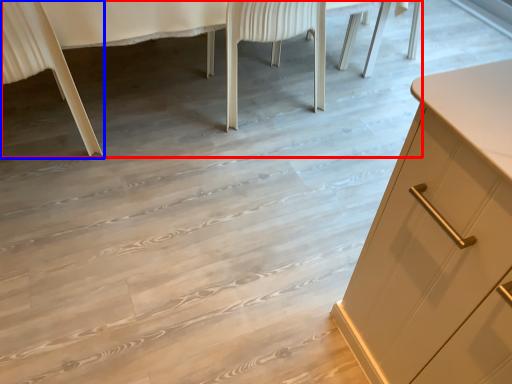
Question: Which point is further to the camera, vanity (highlighted by a red box) or chair (highlighted by a blue box)?

Choices:
 (A) vanity
 (B) chair

Answer: (A)